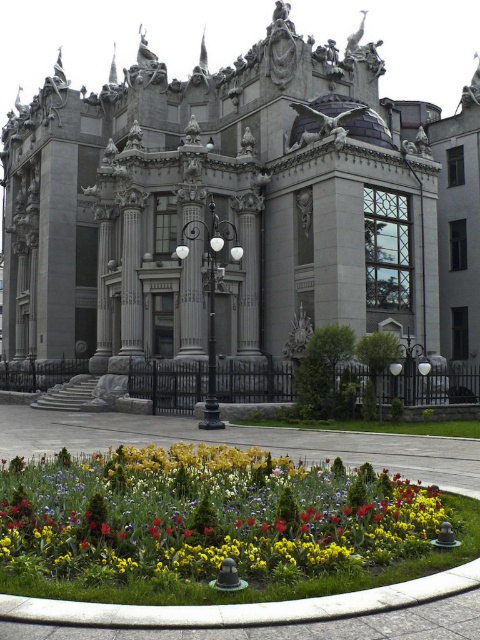
You are a landscape architect designing a pathway that needs to pass between the gray stone palace at center and the yellow matte flowers at lower center. The pathway must be at least 2 meters wide to accommodate visitors. Given the spatial relationship between these two elements, can the pathway be safely constructed without encroaching on either the palace or the flower bed?

The gray stone palace at center is wider than the yellow matte flowers at lower center. Since the palace is wider, there is sufficient space between them to construct a 2 meter wide pathway without encroaching on either element.

You are a visitor standing in front of the gray stone palace at center and the yellow matte flowers at lower center. Which object is taller?

The gray stone palace at center is much taller than the yellow matte flowers at lower center.